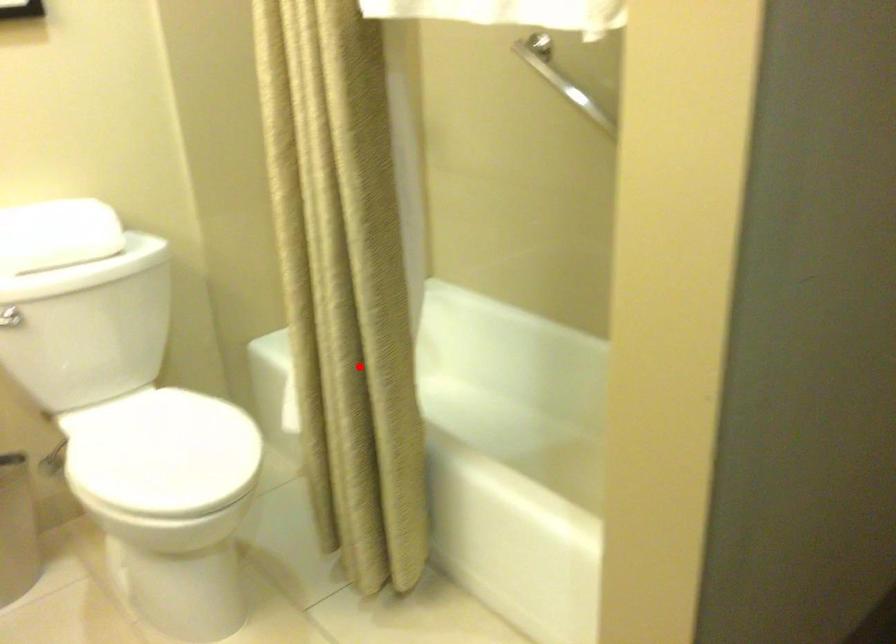
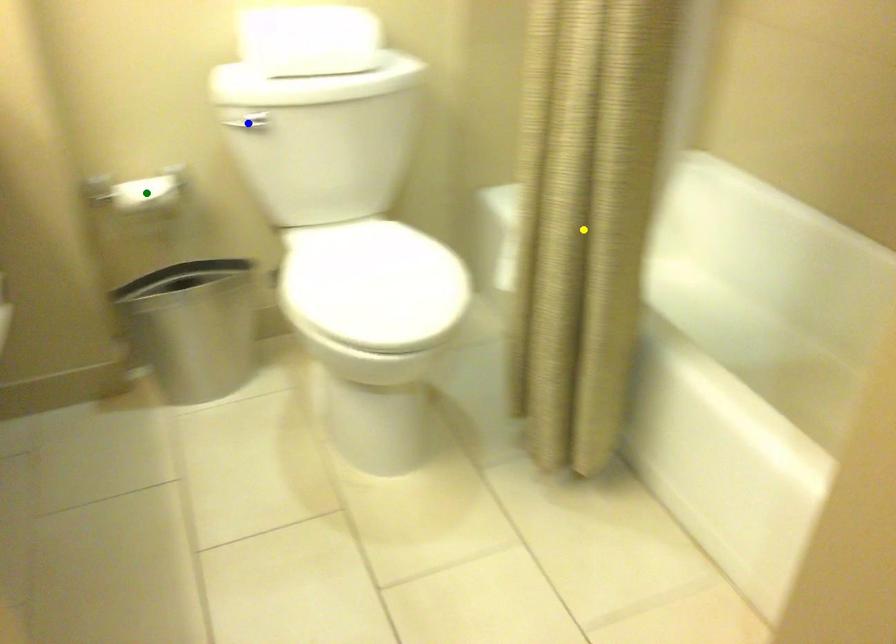
Question: I am providing you with two images of the same scene from different viewpoints. A red point is marked on the first image. You are given multiple points on the second image. Can you choose the point in image 2 that corresponds to the point in image 1?

Choices:
 (A) green point
 (B) yellow point
 (C) blue point

Answer: (B)